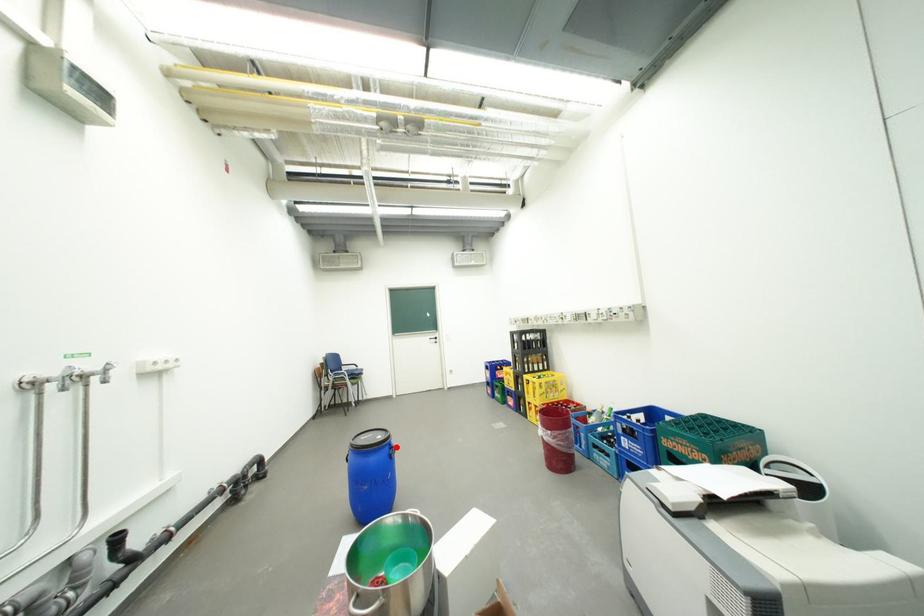
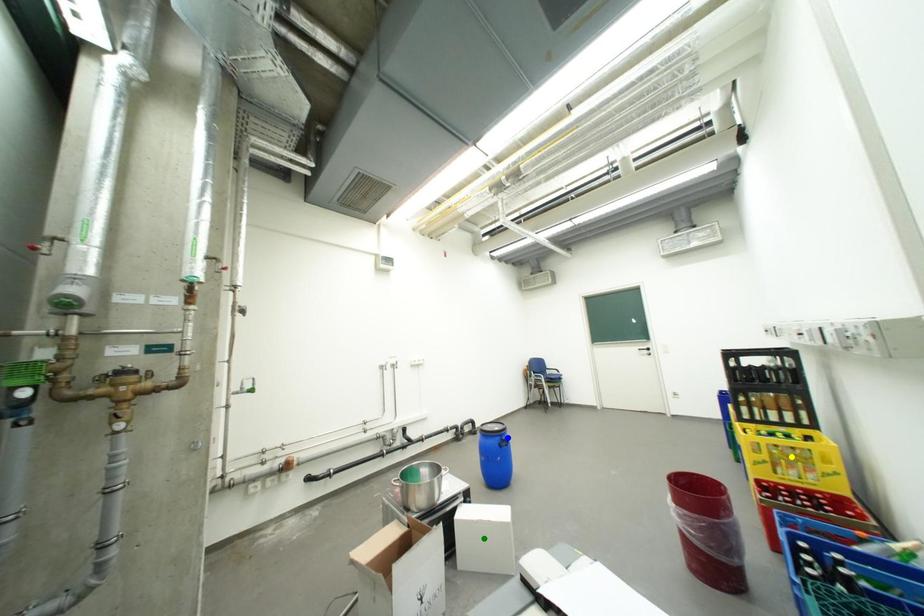
Question: I am providing you with two images of the same scene from different viewpoints. A red point is marked on the first image. You are given multiple points on the second image. Which point in image 2 represents the same 3d spot as the red point in image 1?

Choices:
 (A) blue point
 (B) green point
 (C) yellow point

Answer: (A)